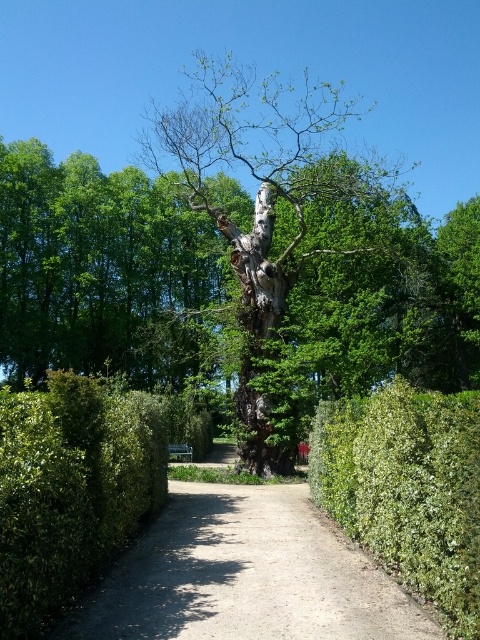
Question: Is dirt/gravel path at center thinner than green leafy hedge at right?

Choices:
 (A) no
 (B) yes

Answer: (A)

Question: Among these objects, which one is nearest to the camera?

Choices:
 (A) green leafy hedge at center
 (B) green leafy hedge at right
 (C) dark brown bark tree at center

Answer: (A)

Question: Which of these objects is positioned farthest from the green leafy hedge at right?

Choices:
 (A) green leafy hedge at center
 (B) dirt/gravel path at center
 (C) dark brown bark tree at center

Answer: (C)

Question: Can you confirm if dirt/gravel path at center is positioned above green leafy hedge at right?

Choices:
 (A) yes
 (B) no

Answer: (B)

Question: Can you confirm if green leafy hedge at center is bigger than green leafy hedge at right?

Choices:
 (A) yes
 (B) no

Answer: (A)

Question: Which object is the farthest from the green leafy hedge at right?

Choices:
 (A) dark brown bark tree at center
 (B) green leafy hedge at center
 (C) dirt/gravel path at center

Answer: (A)